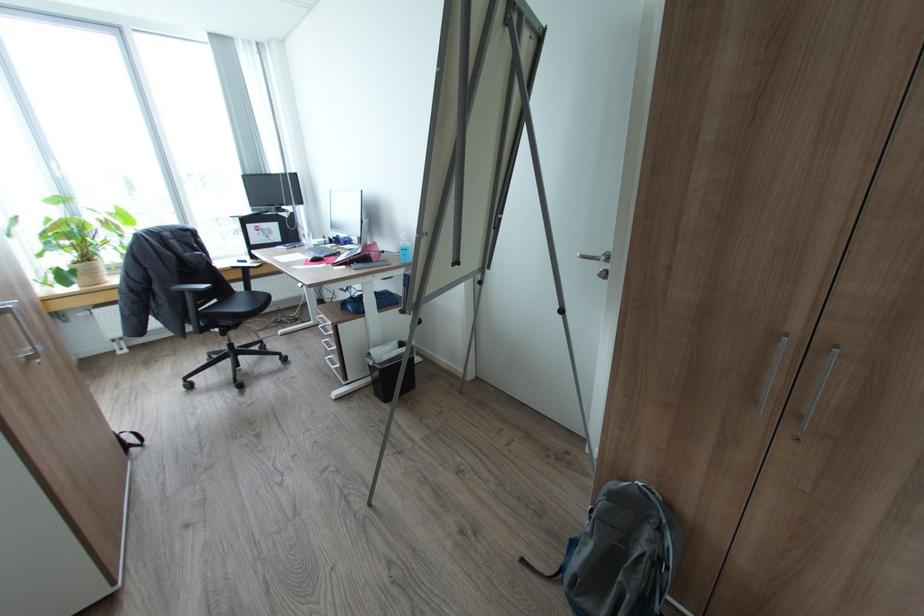
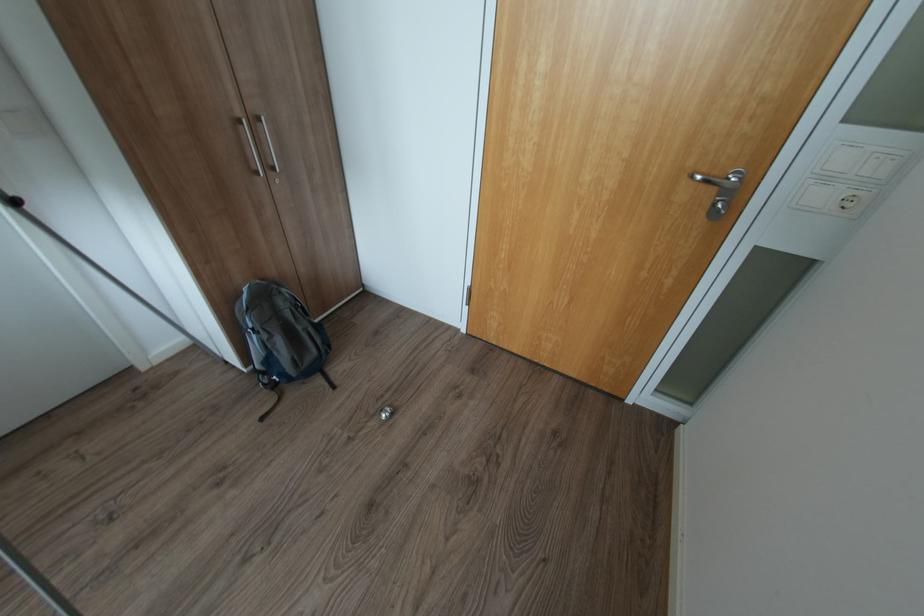
First-person continuous shooting, in which direction is the camera rotating?

The rotation direction of the camera is right-down.